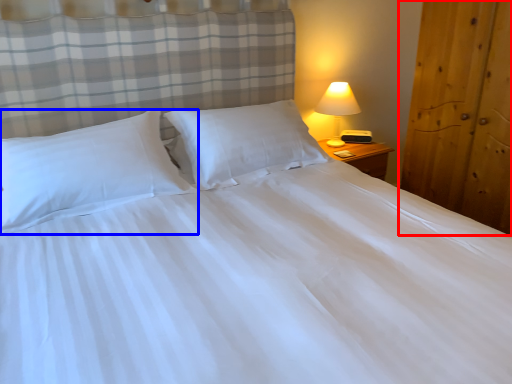
Question: Among these objects, which one is farthest to the camera, armoire (highlighted by a red box) or pillow (highlighted by a blue box)?

Choices:
 (A) armoire
 (B) pillow

Answer: (A)